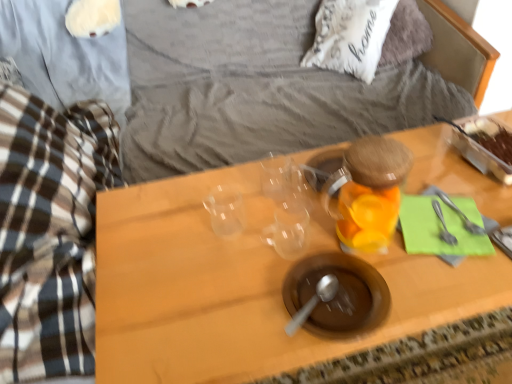
The image size is (512, 384). What are the coordinates of `free spot to the left of silver metallic fork at right, which is the 1th silverware from right to left` in the screenshot? It's located at (391, 235).